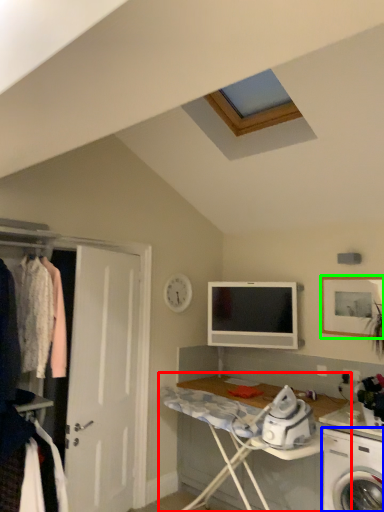
Question: Which object is the farthest from desk (highlighted by a red box)? Choose among these: washing machine (highlighted by a blue box) or picture frame (highlighted by a green box).

Choices:
 (A) washing machine
 (B) picture frame

Answer: (B)